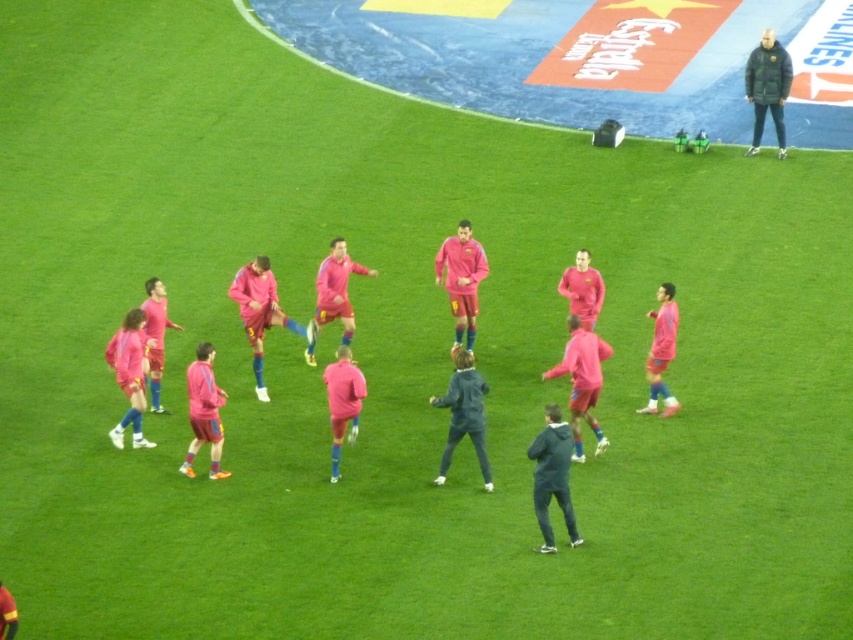
Question: Among these points, which one is farthest from the camera?

Choices:
 (A) (438, 275)
 (B) (311, 358)
 (C) (675, 410)

Answer: (B)

Question: Estimate the real-world distances between objects in this image. Which object is closer to the matte pink jersey at center?

Choices:
 (A) dark blue jacket at center
 (B) pink matte jersey at center
 (C) dark green puffer jacket at upper right

Answer: (B)

Question: Is dark blue jacket at center in front of dark green puffer jacket at upper right?

Choices:
 (A) no
 (B) yes

Answer: (B)

Question: Is pink matte soccer uniforms at center smaller than dark blue jacket at center?

Choices:
 (A) yes
 (B) no

Answer: (B)

Question: Is dark green puffer jacket at upper right further to camera compared to pink matte jersey at center?

Choices:
 (A) yes
 (B) no

Answer: (A)

Question: Which object is the closest to the dark blue jacket at center?

Choices:
 (A) dark green puffer jacket at upper right
 (B) matte pink jersey at center
 (C) pink matte jersey at center
 (D) pink matte soccer uniforms at center

Answer: (D)